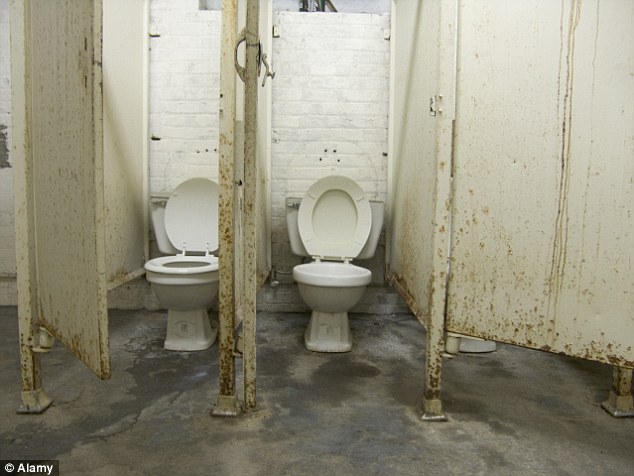
Find the location of a particular element. brick wall behind toilet is located at coordinates (181, 102), (337, 107).